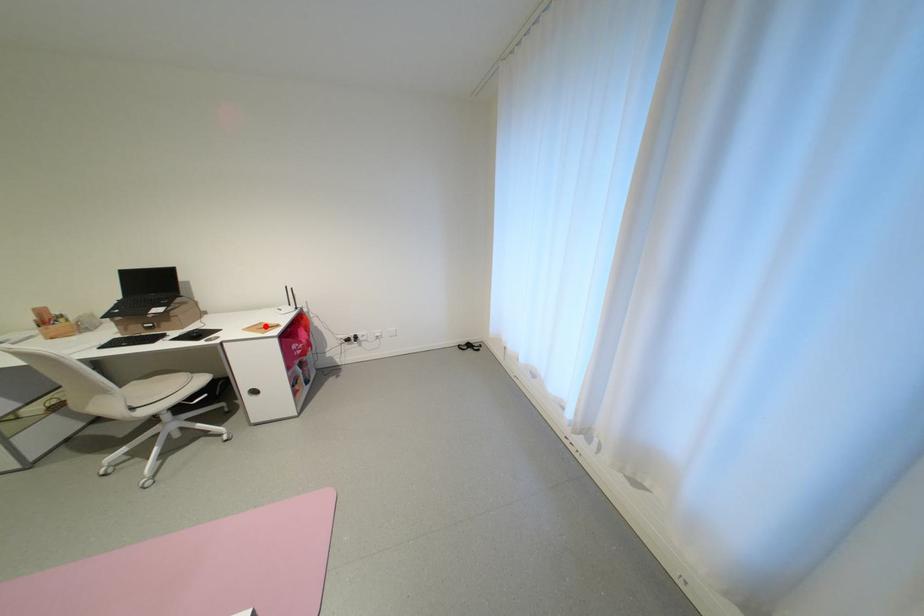
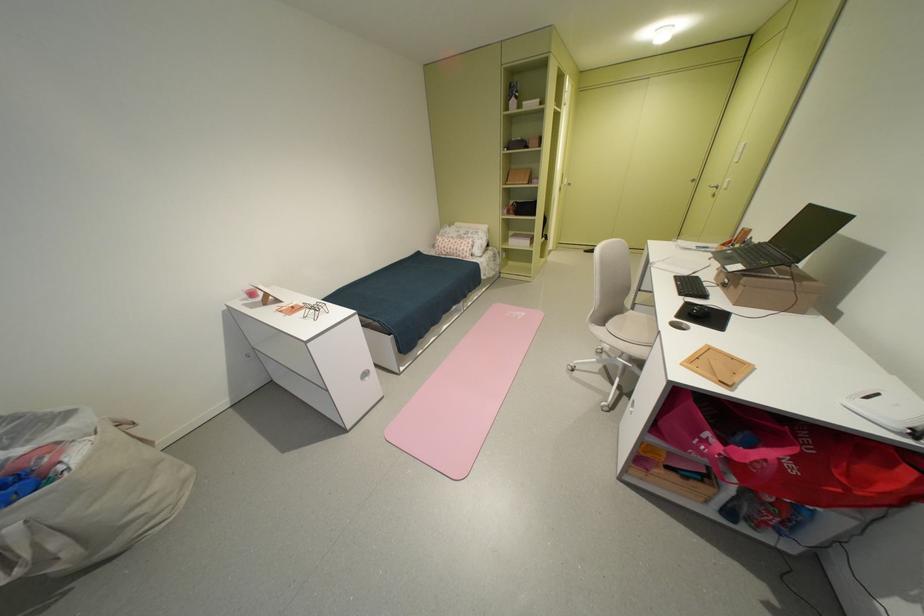
Question: I am providing you with two images of the same scene from different viewpoints. In image1, a red point is highlighted. Considering the same 3D point in image2, which of the following is correct?

Choices:
 (A) It is closer
 (B) It is farther

Answer: (B)